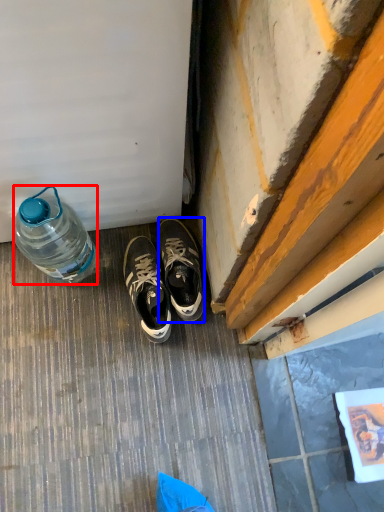
Question: Which point is closer to the camera, bottle (highlighted by a red box) or sneakers (highlighted by a blue box)?

Choices:
 (A) bottle
 (B) sneakers

Answer: (A)